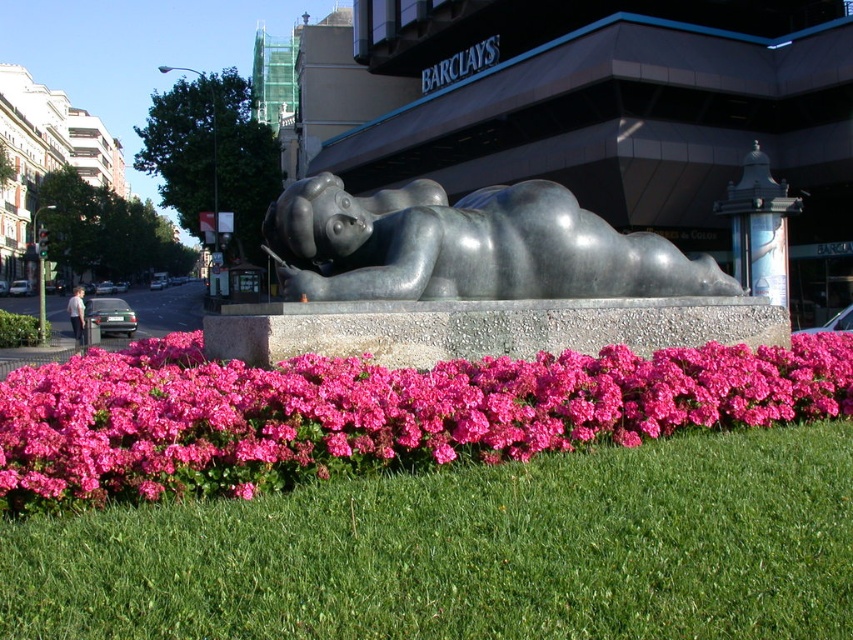
You are a gardener who wants to plant new flowers in the city square. You have a limited budget and can only choose between the green grass at lower center or the pink matte flowers at center for a new bed. Which option would allow for taller plants to be displayed?

The pink matte flowers at center are taller than the green grass at lower center, so choosing them would allow for displaying taller plants.

You are standing at the base of the sculpture and want to walk to the point labeled point (518,285). Which direction should you go relative to the point labeled point (190,442)?

You should move behind the point labeled point (190,442) to reach point (518,285) because point (190,442) is in front of point (518,285).